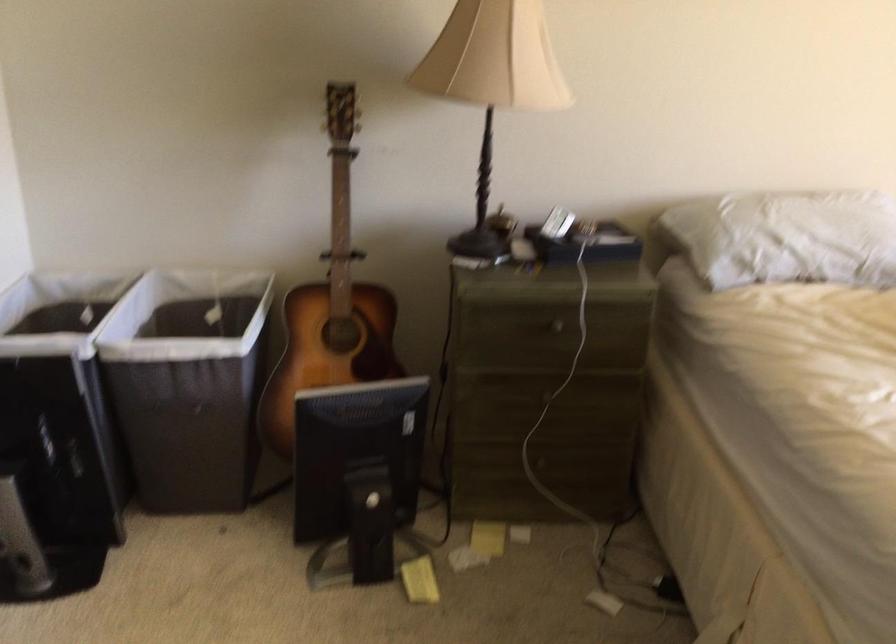
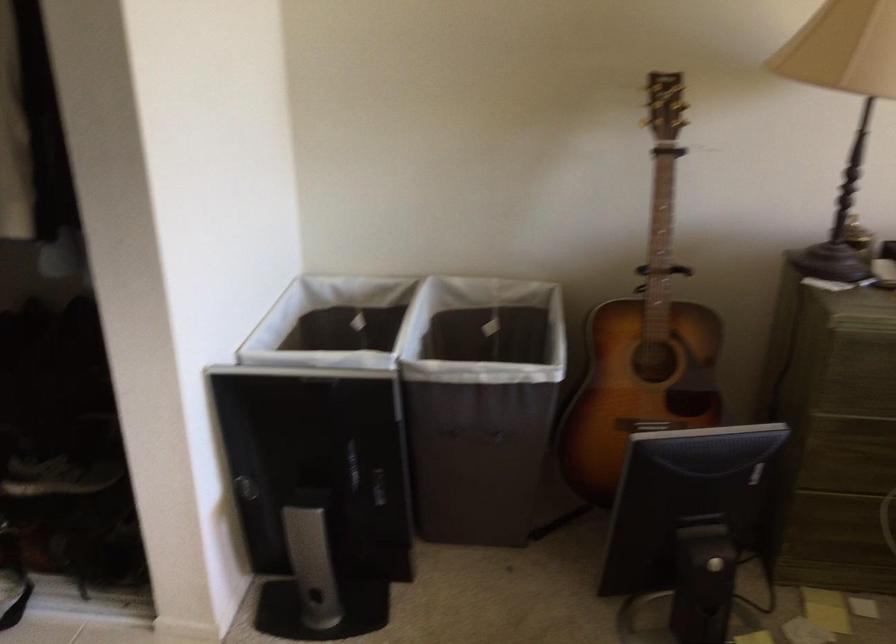
What movement of the cameraman would produce the second image?

The movement direction of the cameraman is left, forward.